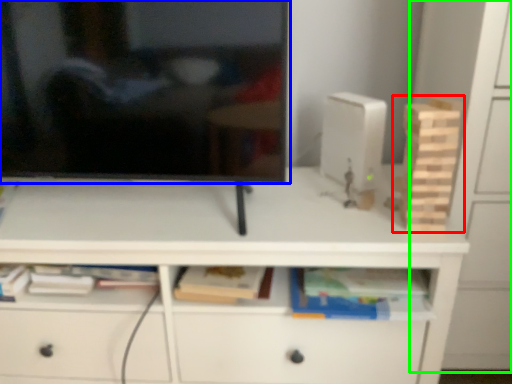
Question: Which is nearer to the toy (highlighted by a red box)? television (highlighted by a blue box) or cabinetry (highlighted by a green box).

Choices:
 (A) television
 (B) cabinetry

Answer: (B)